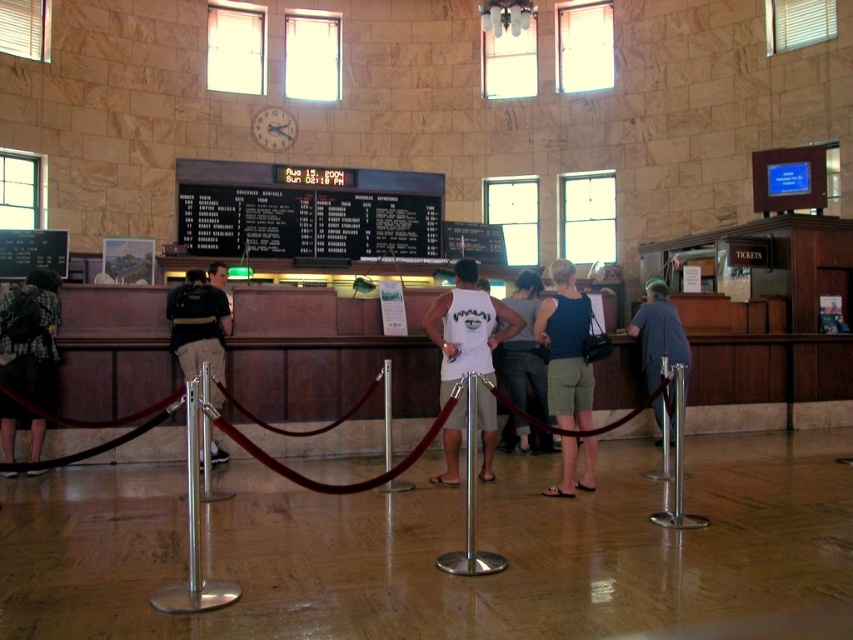
Question: Which point is farther to the camera?

Choices:
 (A) (561, 320)
 (B) (683, 333)

Answer: (B)

Question: Does white matte tank top at center have a smaller size compared to black fabric shirt at left?

Choices:
 (A) no
 (B) yes

Answer: (A)

Question: Is black matte board at center bigger than dark gray backpack at center?

Choices:
 (A) no
 (B) yes

Answer: (B)

Question: Which object is the closest to the plaid fabric shirt at left?

Choices:
 (A) blue cotton tank top at center
 (B) white cotton tank top at center
 (C) white matte tank top at center
 (D) black matte board at center

Answer: (C)

Question: Among these objects, which one is nearest to the camera?

Choices:
 (A) black matte board at center
 (B) gray fabric shirt at center
 (C) dark gray backpack at center
 (D) black fabric shirt at left

Answer: (C)

Question: Is the position of blue cotton tank top at center less distant than that of dark gray backpack at center?

Choices:
 (A) yes
 (B) no

Answer: (A)